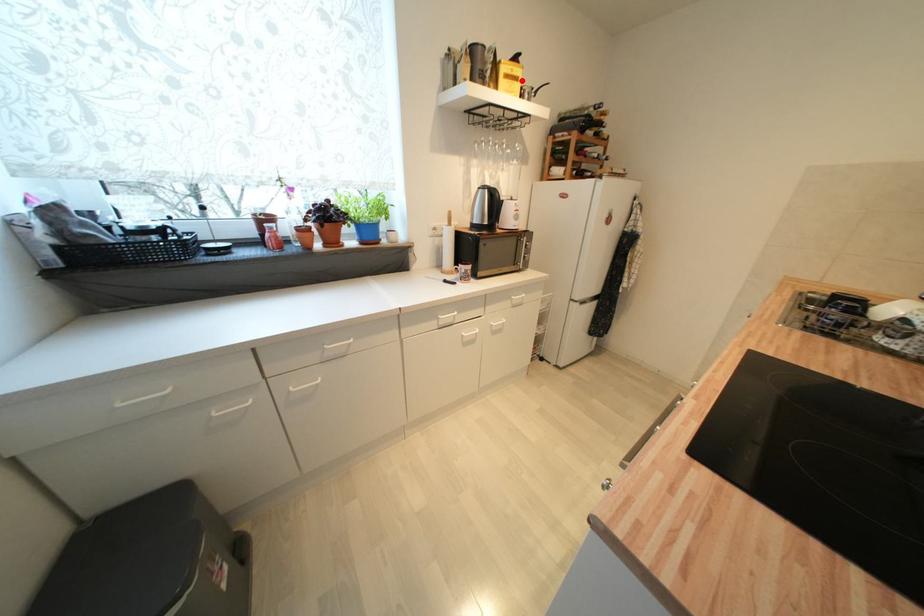
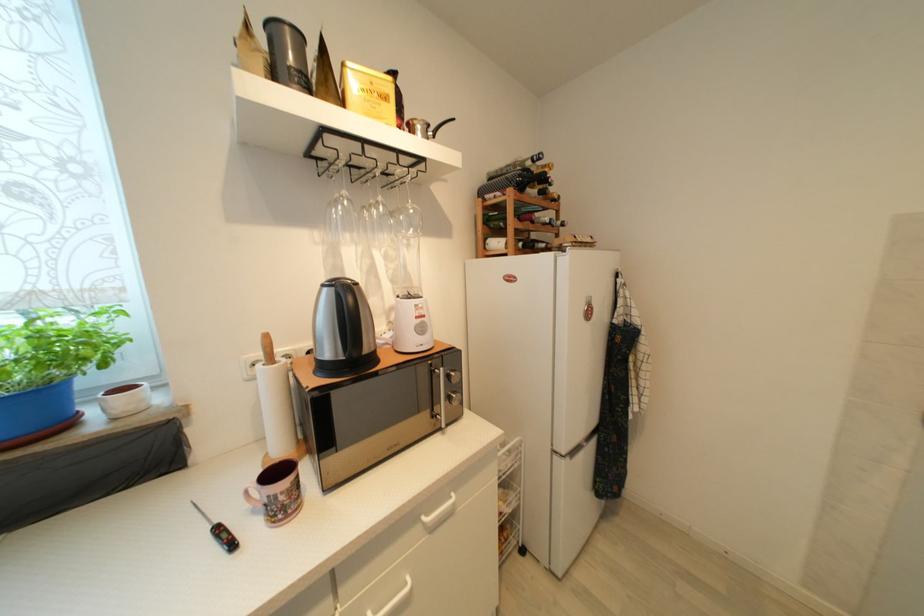
Locate, in the second image, the point that corresponds to the highlighted location in the first image.

(391, 100)